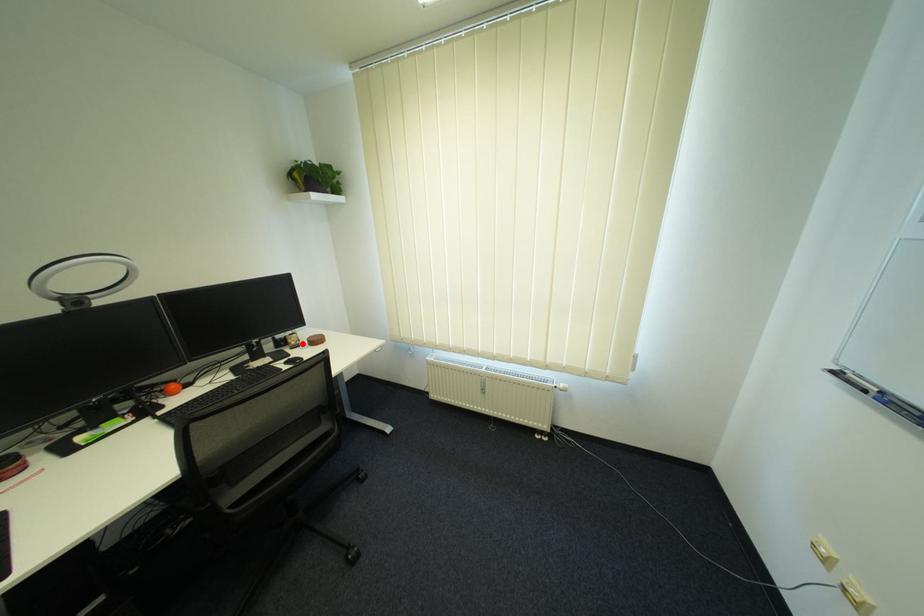
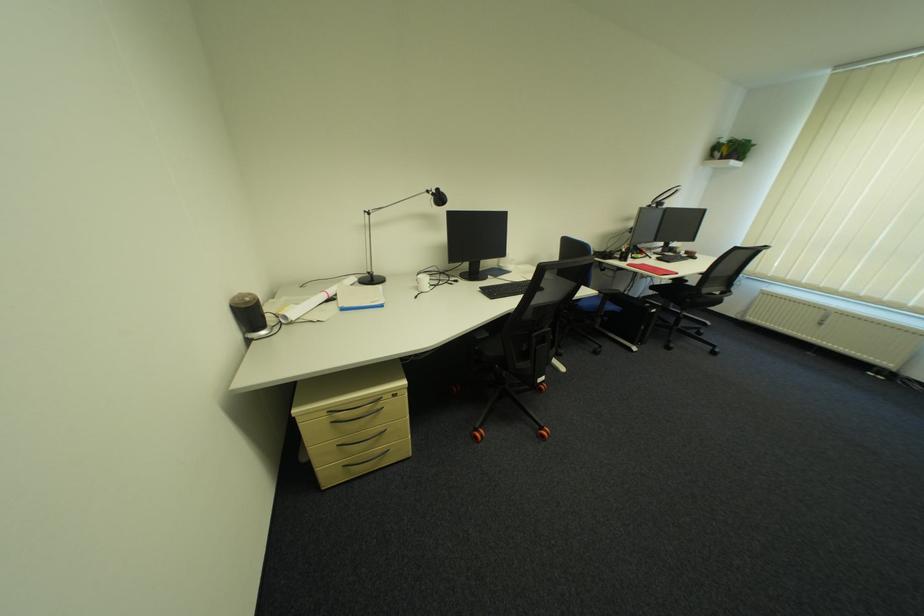
Find the pixel in the second image that matches the highlighted location in the first image.

(687, 252)